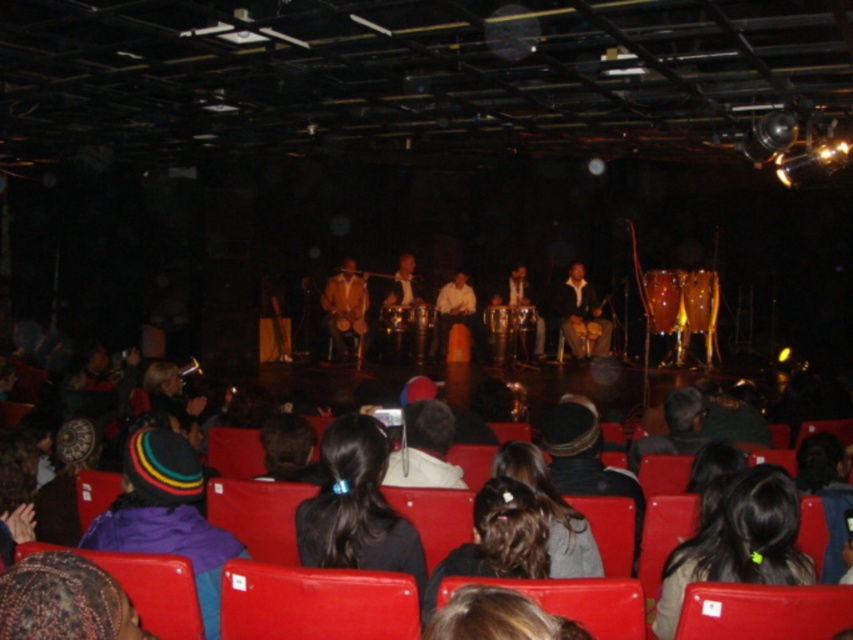
Does point (347, 296) come farther from viewer compared to point (462, 320)?

No, it is not.

Does leather jacket at center have a lesser height compared to smooth brown drum at center?

Incorrect, leather jacket at center's height does not fall short of smooth brown drum at center's.

Where is `leather jacket at center`? This screenshot has height=640, width=853. leather jacket at center is located at coordinates tap(345, 307).

Find the location of a particular element. Image resolution: width=853 pixels, height=640 pixels. leather jacket at center is located at coordinates (345, 307).

Is black leather jacket at center smaller than dark brown hair at lower right?

Yes.

Who is taller, black leather jacket at center or dark brown hair at lower right?

Standing taller between the two is dark brown hair at lower right.

Locate an element on the screen. black leather jacket at center is located at coordinates (258, 515).

Locate an element on the screen. Image resolution: width=853 pixels, height=640 pixels. black leather jacket at center is located at coordinates (258, 515).

Is matte brown drum at center positioned before smooth brown drum at center?

Yes, matte brown drum at center is in front of smooth brown drum at center.

This screenshot has height=640, width=853. Find the location of `matte brown drum at center`. matte brown drum at center is located at coordinates (581, 317).

Locate an element on the screen. The height and width of the screenshot is (640, 853). matte brown drum at center is located at coordinates (581, 317).